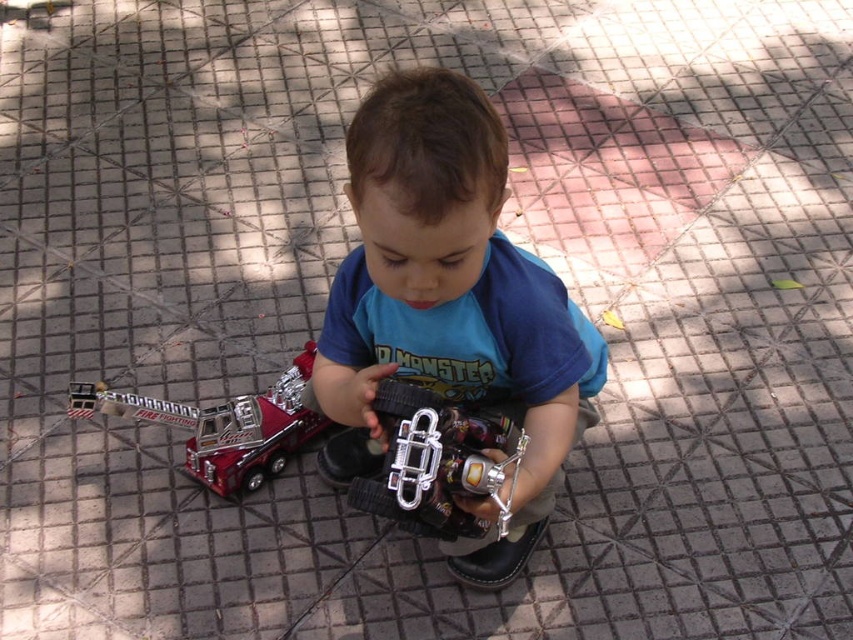
Question: Which of the following is the closest to the observer?

Choices:
 (A) (73, 408)
 (B) (463, 339)

Answer: (B)

Question: Where is blue cotton shirt at center located in relation to metallic red fire truck at lower left in the image?

Choices:
 (A) right
 (B) left

Answer: (A)

Question: Is blue cotton shirt at center closer to the viewer compared to metallic red fire truck at lower left?

Choices:
 (A) yes
 (B) no

Answer: (A)

Question: Which point is farther to the camera?

Choices:
 (A) (299, 420)
 (B) (554, 342)

Answer: (A)

Question: Can you confirm if blue cotton shirt at center is positioned above metallic red fire truck at lower left?

Choices:
 (A) no
 (B) yes

Answer: (B)